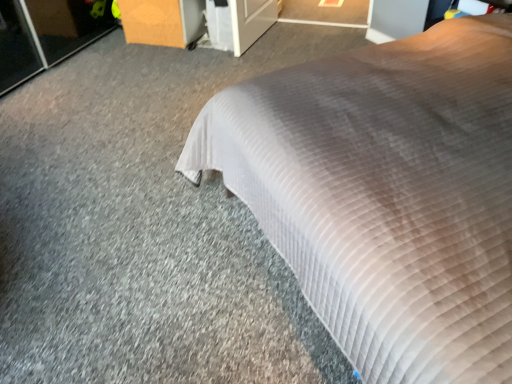
You are a GUI agent. You are given a task and a screenshot of the screen. Output one action in this format:
    pyautogui.click(x=<x>, y=<y>)
    Task: Click on the white quilted bed at center
    This screenshot has height=384, width=512.
    Given the screenshot: What is the action you would take?
    pyautogui.click(x=386, y=194)

Describe the element at coordinates (386, 194) in the screenshot. I see `white quilted bed at center` at that location.

At what (x,y) coordinates should I click in order to perform the action: click on white quilted bed at center. Please return your answer as a coordinate pair (x, y). This screenshot has width=512, height=384. Looking at the image, I should click on (386, 194).